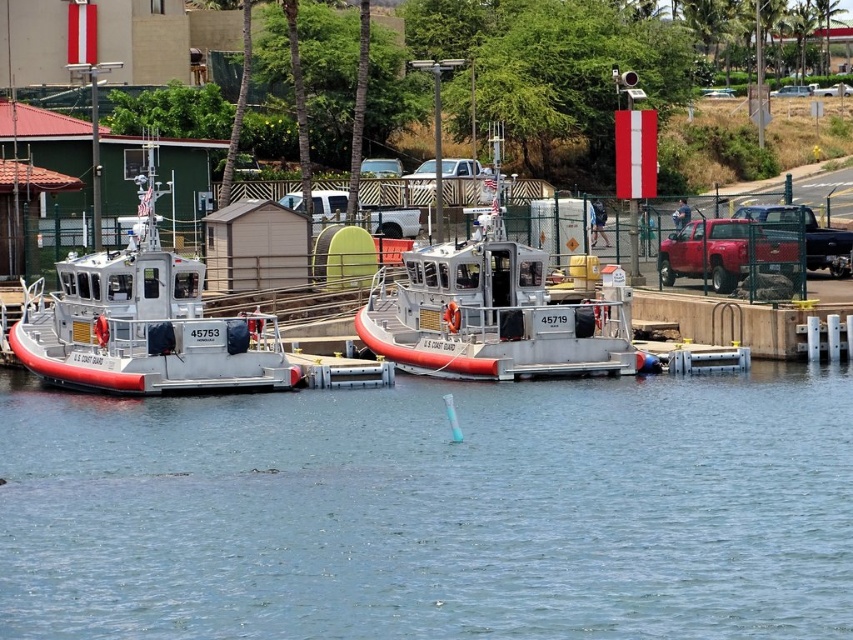
Question: Can you confirm if transparent water at center is thinner than white matte boat at center?

Choices:
 (A) yes
 (B) no

Answer: (B)

Question: Which point is farther from the camera taking this photo?

Choices:
 (A) (612, 308)
 (B) (343, 561)

Answer: (A)

Question: Does transparent water at center appear over white rubber boat at left?

Choices:
 (A) no
 (B) yes

Answer: (A)

Question: Is transparent water at center to the right of white matte boat at center from the viewer's perspective?

Choices:
 (A) yes
 (B) no

Answer: (B)

Question: Estimate the real-world distances between objects in this image. Which object is closer to the white rubber boat at left?

Choices:
 (A) white matte boat at center
 (B) transparent water at center

Answer: (A)

Question: Estimate the real-world distances between objects in this image. Which object is closer to the white matte boat at center?

Choices:
 (A) transparent water at center
 (B) white rubber boat at left

Answer: (B)